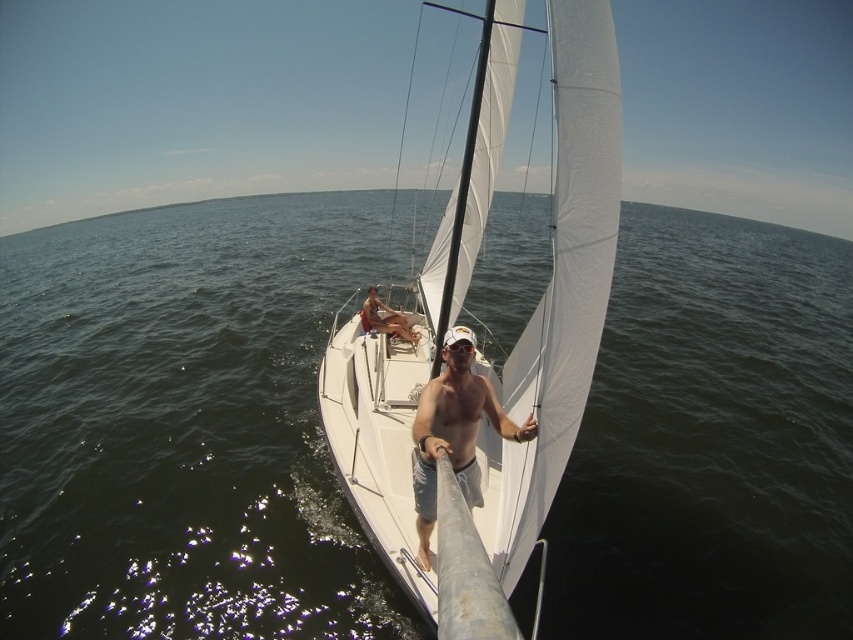
Question: Considering the real-world distances, which object is closest to the black rubber goggles at center?

Choices:
 (A) tan skin man at center
 (B) dark green water at center
 (C) white matte sailboat at center

Answer: (C)

Question: Is tan skin man at center to the right of black rubber goggles at center from the viewer's perspective?

Choices:
 (A) yes
 (B) no

Answer: (B)

Question: Can you confirm if shiny metallic pole at center is positioned to the right of tan skin man at center?

Choices:
 (A) no
 (B) yes

Answer: (B)

Question: In this image, where is dark green water at center located relative to white matte sailboat at center?

Choices:
 (A) above
 (B) below

Answer: (A)

Question: Considering the real-world distances, which object is closest to the shiny metallic pole at center?

Choices:
 (A) white matte sailboat at center
 (B) black rubber goggles at center
 (C) dark green water at center

Answer: (B)

Question: Among these points, which one is nearest to the camera?

Choices:
 (A) (595, 182)
 (B) (10, 250)
 (C) (428, 380)
 (D) (453, 349)

Answer: (A)